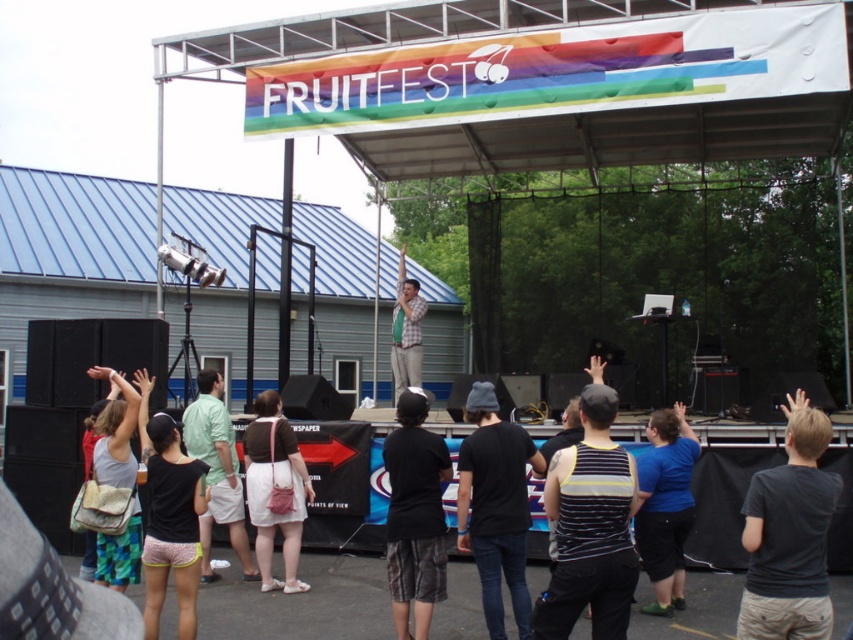
Describe the element at coordinates (274, 486) in the screenshot. The image size is (853, 640). I see `white fabric dress at center` at that location.

Between point (271, 536) and point (245, 552), which one is positioned behind?

The point (245, 552) is more distant.

Does point (282, 531) come behind point (215, 381)?

No.

Identify the location of white fabric dress at center. The width and height of the screenshot is (853, 640). (274, 486).

Does striped tank top at center come in front of green shirt at center?

Yes, it is.

Is striped tank top at center above green shirt at center?

Incorrect, striped tank top at center is not positioned above green shirt at center.

Measure the distance between striped tank top at center and camera.

striped tank top at center is 4.65 meters from camera.

You are a GUI agent. You are given a task and a screenshot of the screen. Output one action in this format:
    pyautogui.click(x=<x>, y=<y>)
    Task: Click on the striped tank top at center
    This screenshot has width=853, height=640.
    Given the screenshot: What is the action you would take?
    pyautogui.click(x=590, y=528)

Does light green fabric shirt at center have a larger size compared to green shirt at center?

No, light green fabric shirt at center is not bigger than green shirt at center.

Who is more distant from viewer, (245, 552) or (397, 278)?

The point (397, 278) is behind.

I want to click on light green fabric shirt at center, so click(x=218, y=472).